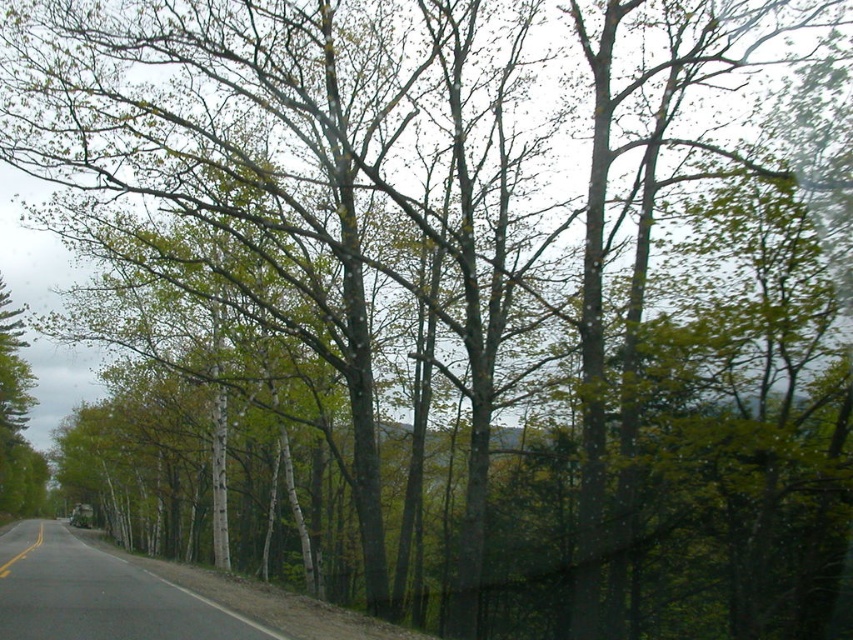
Based on the photo, can you confirm if green matte tree at left is shorter than yellow painted line at road center?

Incorrect, green matte tree at left's height does not fall short of yellow painted line at road center's.

Which is behind, point (3, 506) or point (39, 532)?

Positioned behind is point (3, 506).

The image size is (853, 640). Identify the location of green matte tree at left. (16, 419).